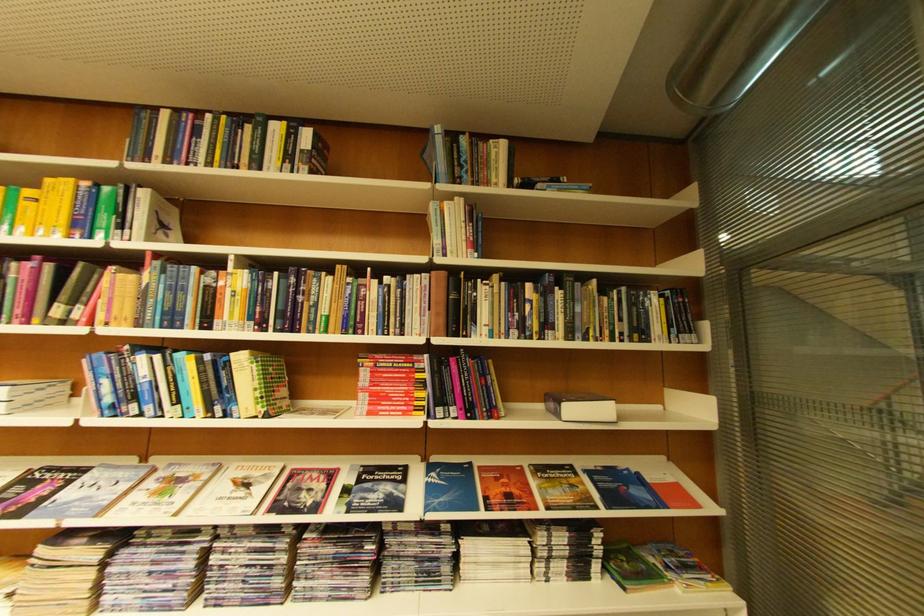
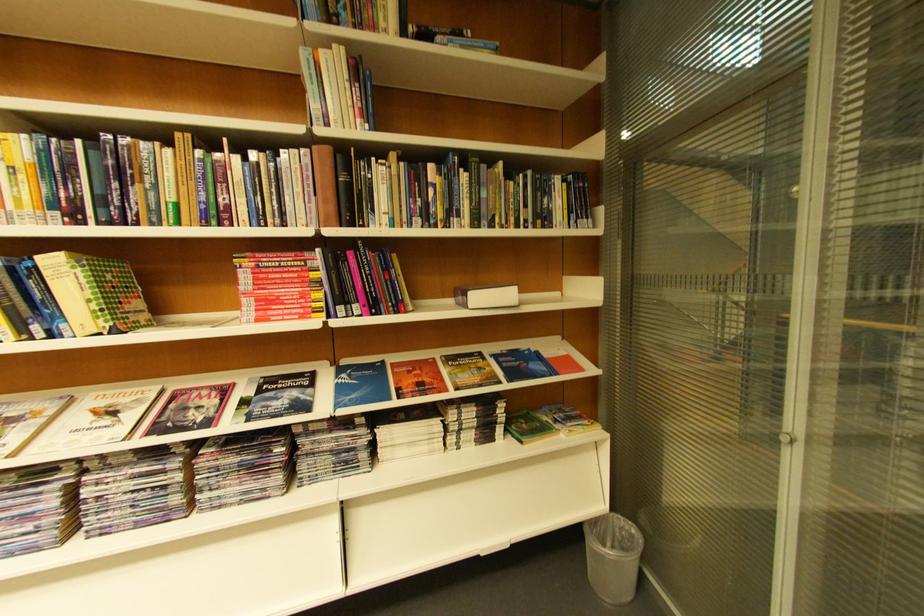
Find the pixel in the second image that matches point 333,472 in the first image.

(224, 389)